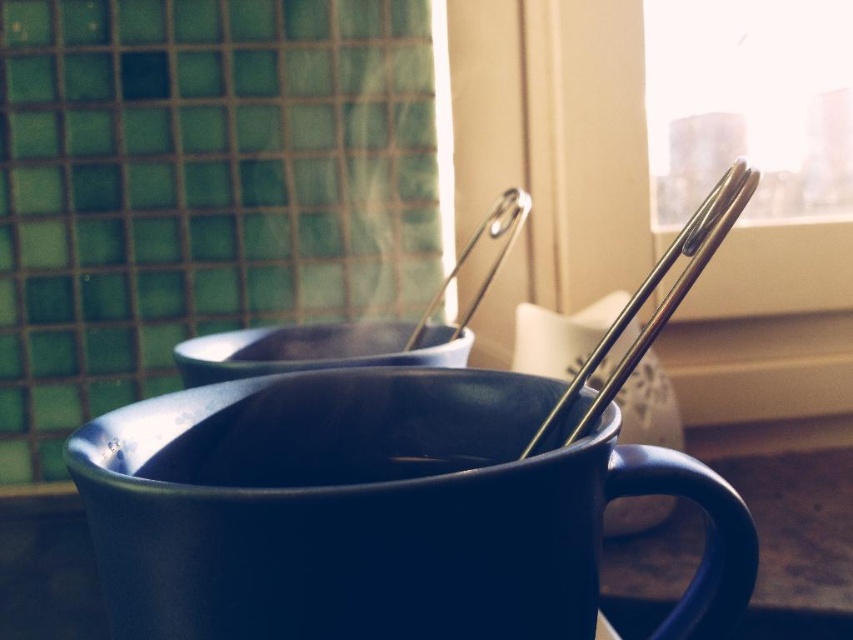
Who is higher up, matte black mug at center or polished metal chopsticks at upper right?

polished metal chopsticks at upper right is higher up.

Who is more distant from viewer, (227, 365) or (637, 346)?

The point (227, 365) is more distant.

Locate an element on the screen. matte black mug at center is located at coordinates (316, 349).

Which is above, matte black mug at center or silver metallic chopstick at upper center?

silver metallic chopstick at upper center is above.

Based on the photo, which is below, matte black mug at center or silver metallic chopstick at upper center?

matte black mug at center

You are a GUI agent. You are given a task and a screenshot of the screen. Output one action in this format:
    pyautogui.click(x=<x>, y=<y>)
    Task: Click on the matte black mug at center
    
    Given the screenshot: What is the action you would take?
    pyautogui.click(x=316, y=349)

Locate an element on the screen. Image resolution: width=853 pixels, height=640 pixels. glossy ceramic mug at center is located at coordinates (378, 512).

Between glossy ceramic mug at center and silver metallic chopstick at upper center, which one is positioned higher?

Positioned higher is silver metallic chopstick at upper center.

Between point (440, 448) and point (521, 218), which one is positioned behind?

Positioned behind is point (521, 218).

Find the location of a particular element. glossy ceramic mug at center is located at coordinates (378, 512).